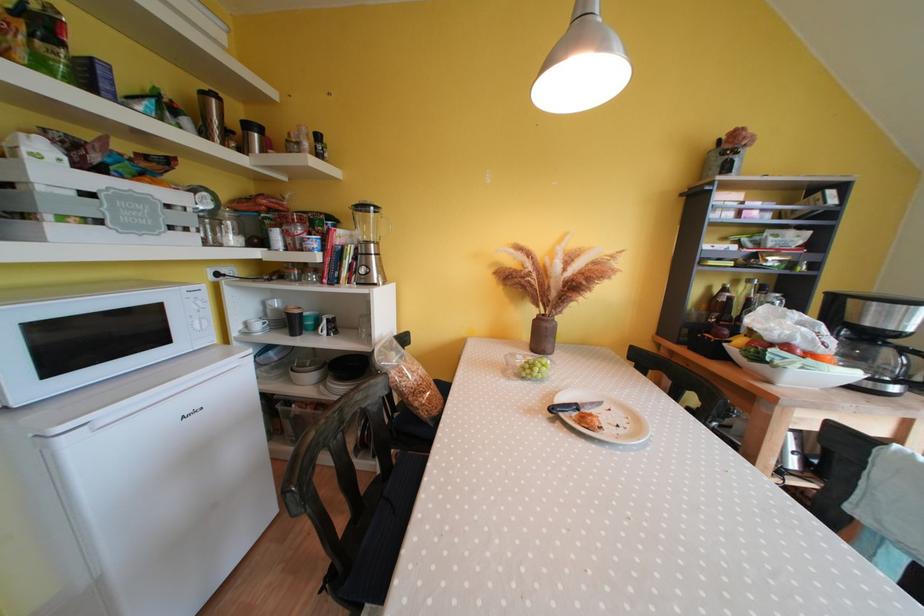
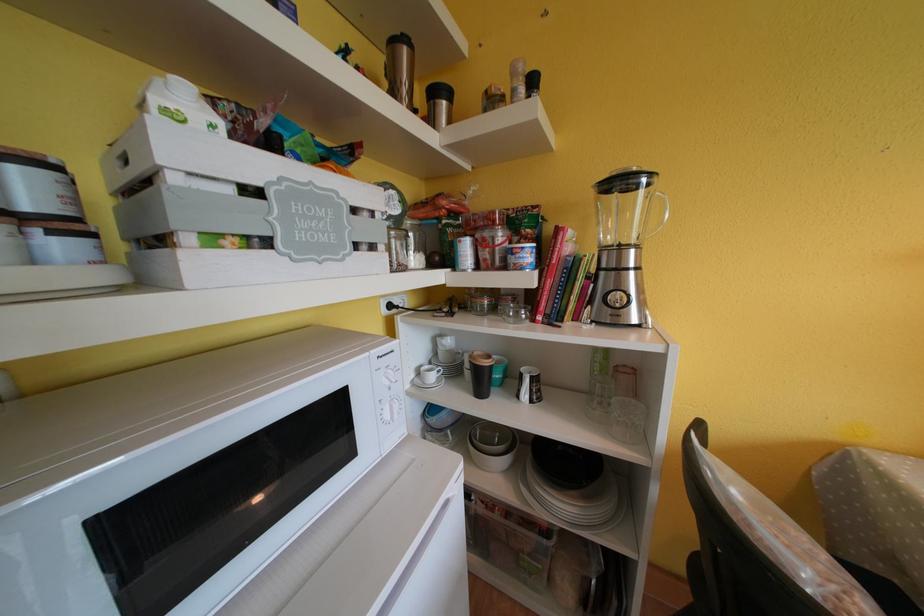
Question: The camera is either moving clockwise (left) or counter-clockwise (right) around the object. The first image is from the beginning of the video and the second image is from the end. Is the camera moving left or right when shooting the video?

Choices:
 (A) Left
 (B) Right

Answer: (B)